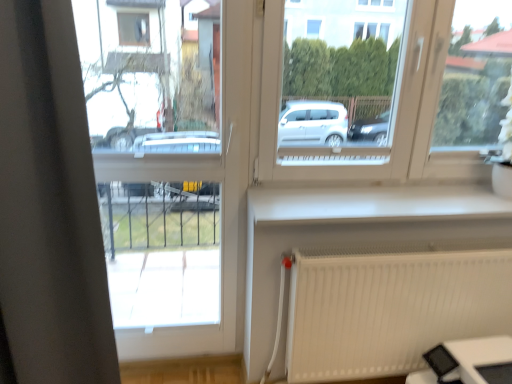
Identify the location of free region under white plastic window at center (from a real-world perspective). pos(372,188).